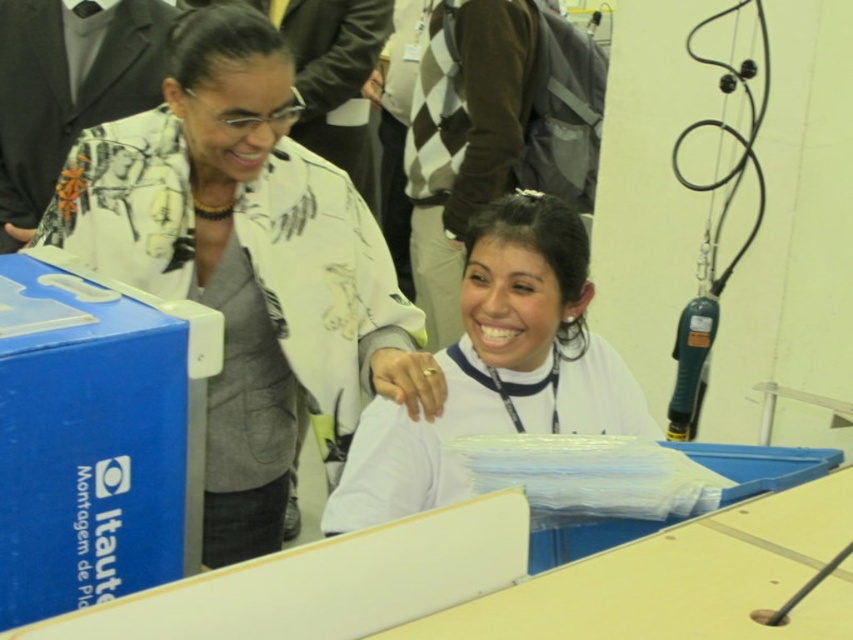
You are at the event and want to find the blue plastic box at lower left. There is a point marked at coordinates (96, 436). Is this point on the blue plastic box at lower left?

Yes, the point marked at coordinates (96, 436) is on the blue plastic box at lower left according to the description.

You are at an event and need to locate the white matte shirt at center. Where would you find it relative to the blue plastic box at lower left?

The white matte shirt at center is to the right of the blue plastic box at lower left.

You are a photographer at the event and need to capture a closeup shot of the white matte shirt at center without including the blue plastic box at lower left in the frame. Based on their positions, is this feasible?

The distance between the blue plastic box at lower left and the white matte shirt at center is 20.03 inches. Since the photographer can adjust the camera angle or zoom to focus solely on the white matte shirt at center while excluding the blue plastic box at lower left, it is feasible to capture the closeup without including the box.